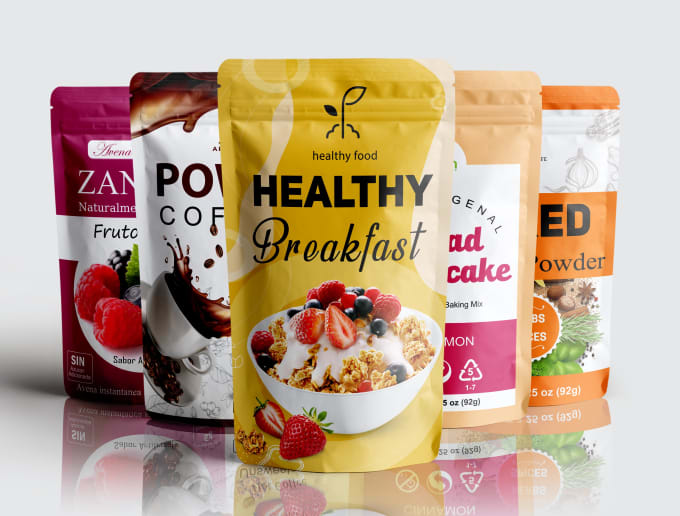
Image resolution: width=680 pixels, height=516 pixels. I want to click on coffee mug, so click(x=170, y=320).